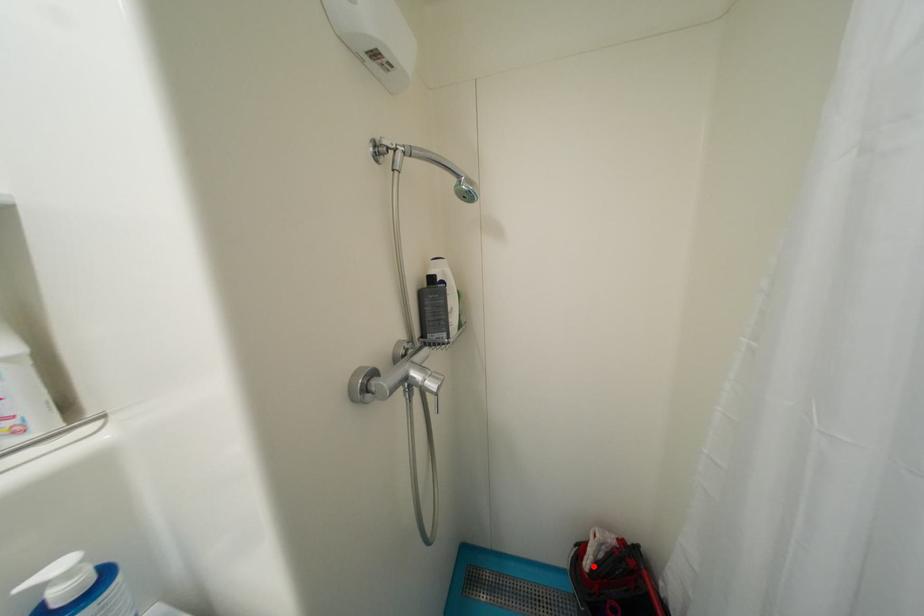
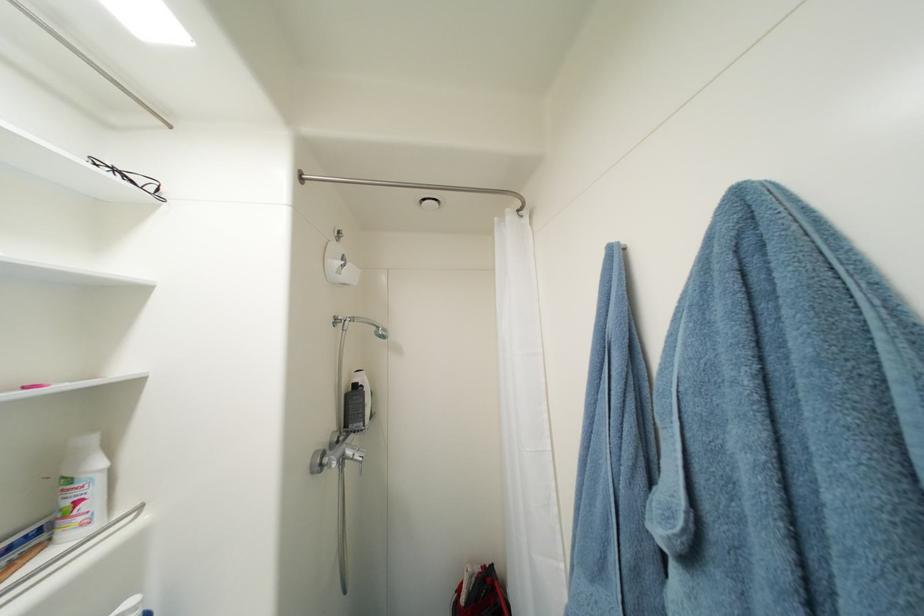
The point at the highlighted location is marked in the first image. Where is the corresponding point in the second image?

(469, 602)